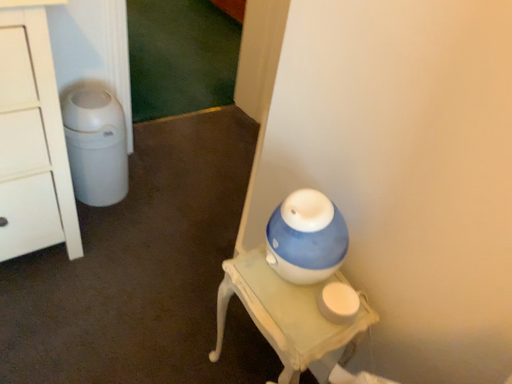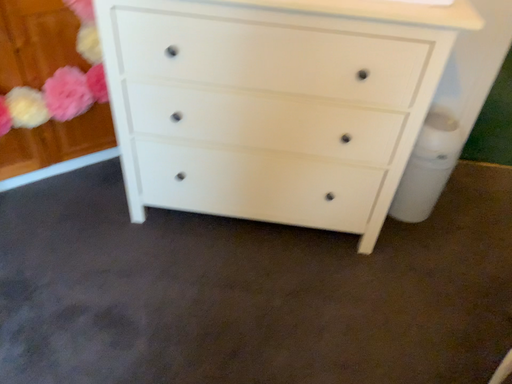
Question: Which way did the camera rotate in the video?

Choices:
 (A) rotated right
 (B) rotated left

Answer: (B)